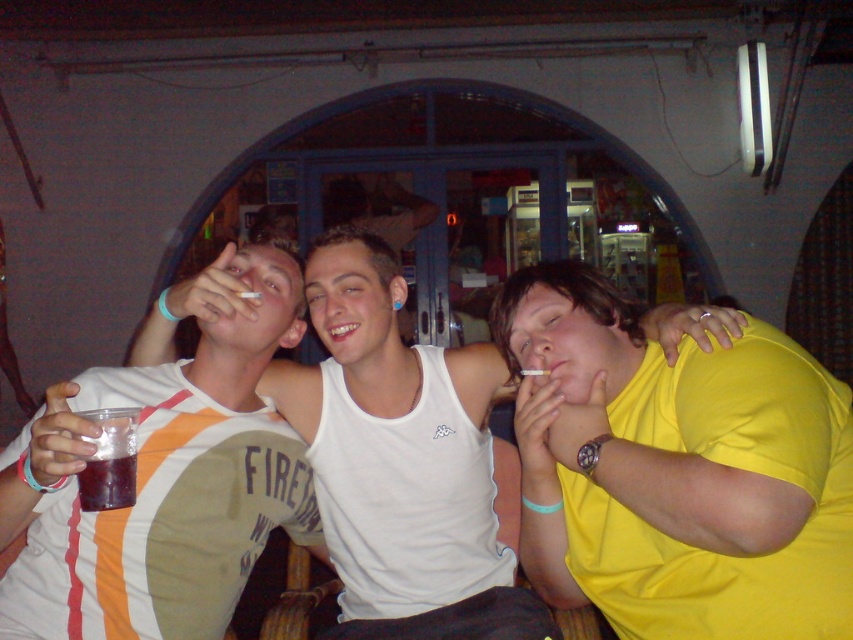
You are standing at the entrance of the room and want to move towards the point at coordinates point (90, 490). However, there is an obstacle at point (544, 342). Will you encounter the obstacle before reaching your destination?

Point (544, 342) is behind point (90, 490), so you will not encounter the obstacle before reaching your destination.

You are a fashion designer observing the two people at the center of the scene. Which individual is wearing a smaller sized shirt between the yellow matte shirt at center and the white tank top at center?

The yellow matte shirt at center has a smaller size compared to the white tank top at center, so the individual wearing the yellow matte shirt at center is wearing the smaller sized shirt.